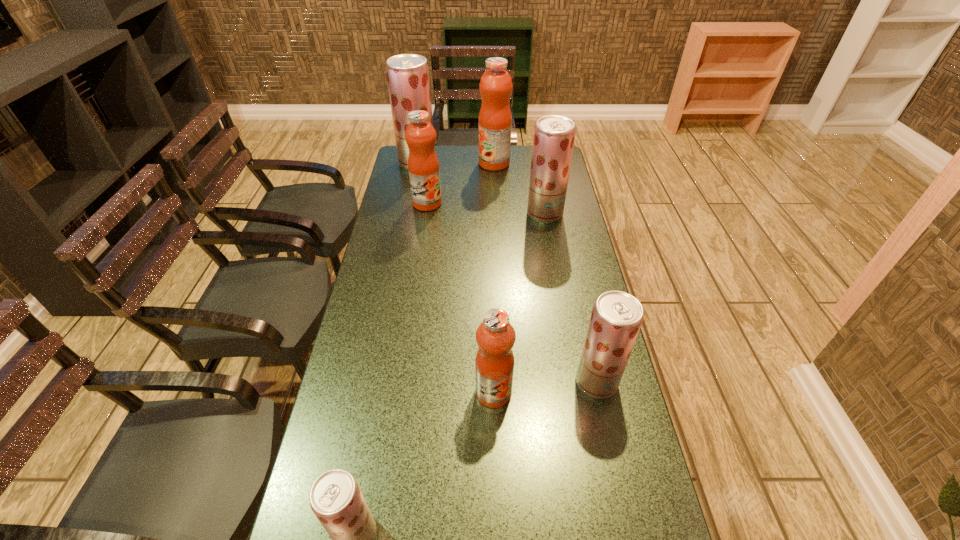
Locate an element on the screen. This screenshot has height=540, width=960. blank space located on the right of the farthest strawberry fruit juice is located at coordinates (499, 163).

Identify the location of free location located 0.220m on the left of the second farthest strawberry fruit juice. The image size is (960, 540). (471, 214).

Locate an element on the screen. The height and width of the screenshot is (540, 960). vacant area located on the front label of the second nearest orange fruit juice is located at coordinates (417, 272).

You are a GUI agent. You are given a task and a screenshot of the screen. Output one action in this format:
    pyautogui.click(x=<x>, y=<y>)
    Task: Click on the vacant region located on the left of the third farthest strawberry fruit juice
    
    Given the screenshot: What is the action you would take?
    pyautogui.click(x=435, y=382)

The width and height of the screenshot is (960, 540). In order to click on vacant space situated on the front label of the smallest orange fruit juice in this screenshot , I will do `click(497, 539)`.

Find the location of `object that is at the far left corner`. object that is at the far left corner is located at coordinates (408, 79).

Locate an element on the screen. This screenshot has width=960, height=540. vacant space at the far edge of the desktop is located at coordinates (522, 156).

Identify the location of blank space at the left edge of the desktop. (381, 374).

I want to click on free space at the right edge, so click(x=556, y=288).

Locate which object ranks second in proximity to the nearest orange fruit juice. Please provide its 2D coordinates. Your answer should be formatted as a tuple, i.e. [(x, y)], where the tuple contains the x and y coordinates of a point satisfying the conditions above.

[(335, 498)]